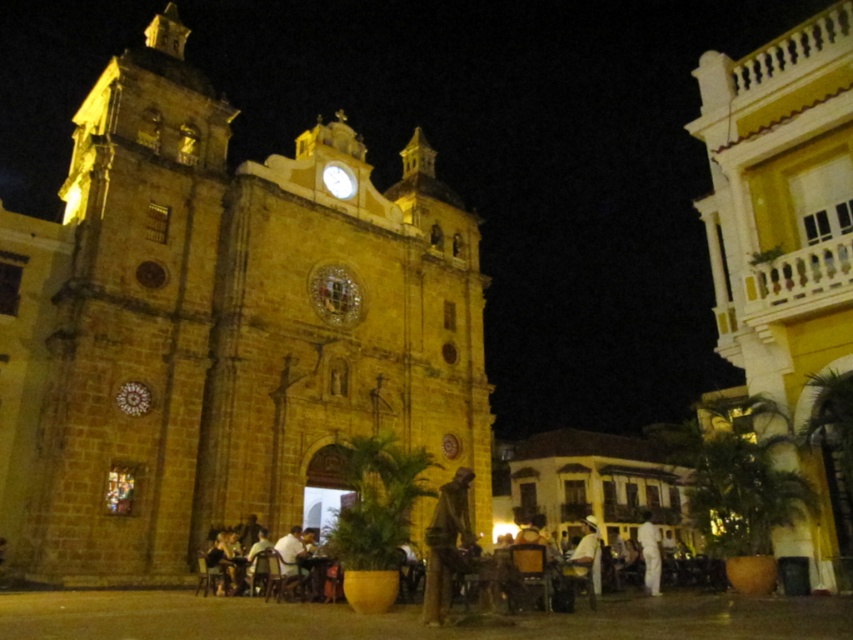
You are standing at point (442, 324) and want to walk to the church entrance. Is the distance less than 300 feet?

The distance between point (442, 324) and the church entrance is 250.62 feet, which is less than 300 feet, so yes.